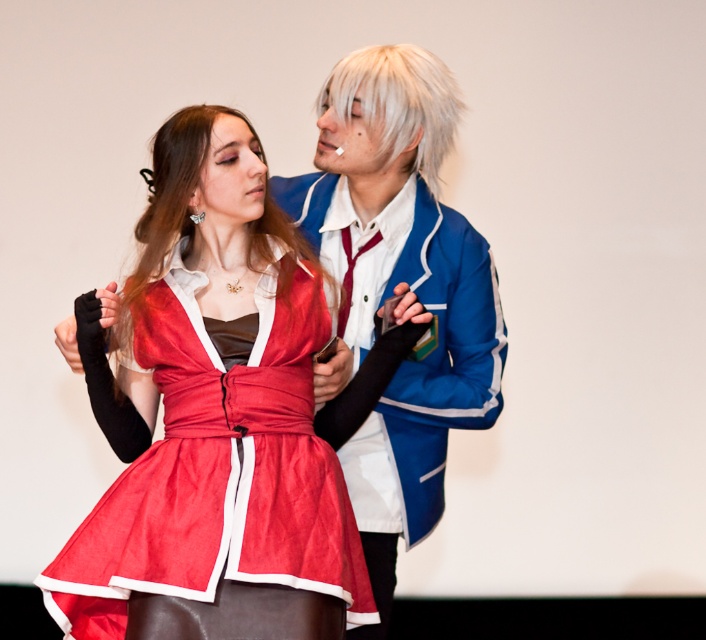
The height and width of the screenshot is (640, 706). What do you see at coordinates (193, 212) in the screenshot?
I see `blonde silky hair at center` at bounding box center [193, 212].

Image resolution: width=706 pixels, height=640 pixels. In order to click on blonde silky hair at center in this screenshot , I will do `click(193, 212)`.

The height and width of the screenshot is (640, 706). What do you see at coordinates (193, 212) in the screenshot?
I see `blonde silky hair at center` at bounding box center [193, 212].

At what (x,y) coordinates should I click in order to perform the action: click on blonde silky hair at center. Please return your answer as a coordinate pair (x, y). Looking at the image, I should click on (193, 212).

Locate an element on the screen. satin dress at center is located at coordinates (217, 468).

Does satin dress at center appear over blue satin jacket at upper center?

Actually, satin dress at center is below blue satin jacket at upper center.

I want to click on satin dress at center, so click(217, 468).

Locate an element on the screen. satin dress at center is located at coordinates (217, 468).

Is blue satin jacket at upper center positioned behind blonde silky hair at center?

Yes, blue satin jacket at upper center is behind blonde silky hair at center.

Who is shorter, blue satin jacket at upper center or blonde silky hair at center?

blonde silky hair at center

Does point (294, 208) lie in front of point (186, 209)?

No, (294, 208) is further to viewer.

This screenshot has width=706, height=640. In order to click on blue satin jacket at upper center in this screenshot , I will do `click(373, 163)`.